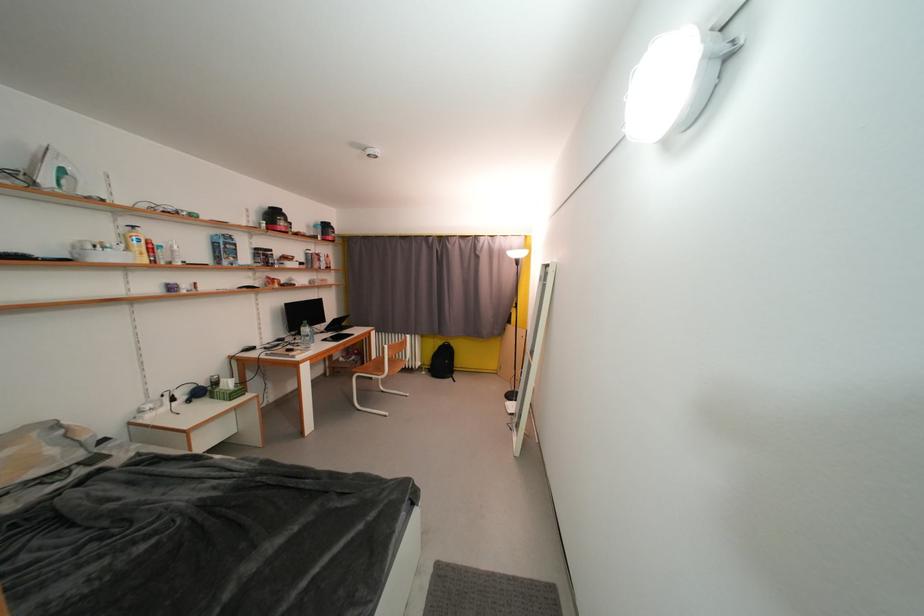
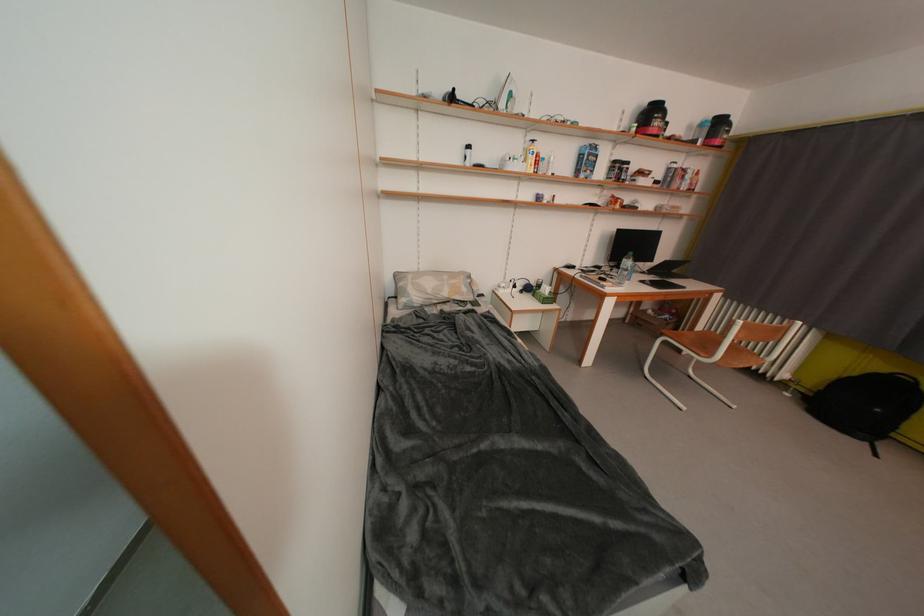
Where in the second image is the point corresponding to (x=61, y=454) from the first image?

(471, 293)